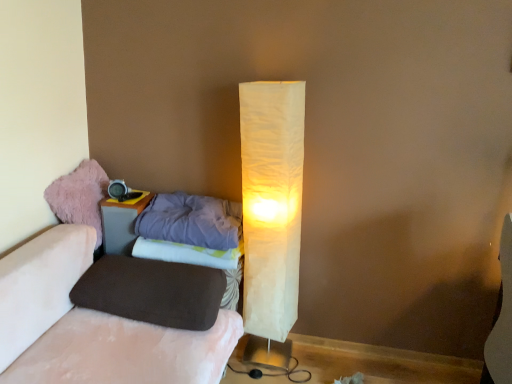
Question: In the image, is fuzzy pink bean bag at left positioned in front of or behind velvet pink couch at lower left?

Choices:
 (A) behind
 (B) front

Answer: (A)

Question: From a real-world perspective, is fuzzy pink bean bag at left physically located above or below velvet pink couch at lower left?

Choices:
 (A) above
 (B) below

Answer: (A)

Question: Estimate the real-world distances between objects in this image. Which object is farther from the white paper lamp at center?

Choices:
 (A) purple fabric sheet at lower center
 (B) fuzzy pink bean bag at left
 (C) velvet pink couch at lower left
 (D) purple soft pillow at left, which is counted as the second pillow, starting from the bottom
 (E) matte gray nightstand at left

Answer: (B)

Question: Which is farther from the white paper lamp at center?

Choices:
 (A) velvet pink couch at lower left
 (B) fuzzy pink bean bag at left
 (C) purple fabric sheet at lower center
 (D) brown fabric pillow at lower left, which is counted as the 1th pillow, starting from the bottom
 (E) purple soft pillow at left, marked as the first pillow in a top-to-bottom arrangement

Answer: (B)